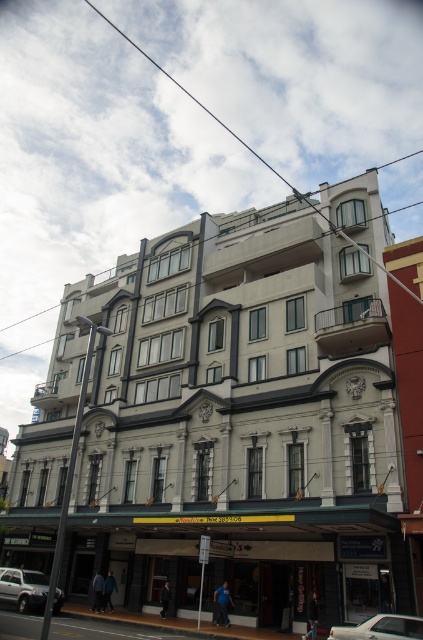
Does point (191, 515) lie behind point (401, 636)?

That is True.

How distant is white smooth building at center from silver metallic sedan at center?

The distance of white smooth building at center from silver metallic sedan at center is 134.25 feet.

Identify the location of white smooth building at center. (227, 419).

Between point (117, 545) and point (43, 582), which one is positioned in front?

Point (43, 582) is in front.

Identify the location of white smooth building at center. The width and height of the screenshot is (423, 640). (227, 419).

The height and width of the screenshot is (640, 423). In order to click on white smooth building at center in this screenshot , I will do `click(227, 419)`.

Who is positioned more to the right, silver metallic car at lower left or silver metallic sedan at center?

silver metallic sedan at center

Can you confirm if silver metallic car at lower left is positioned above silver metallic sedan at center?

No.

You are a GUI agent. You are given a task and a screenshot of the screen. Output one action in this format:
    pyautogui.click(x=<x>, y=<y>)
    Task: Click on the silver metallic car at lower left
    Image resolution: width=423 pixels, height=640 pixels.
    Given the screenshot: What is the action you would take?
    pyautogui.click(x=22, y=588)

Locate an element on the screen. The height and width of the screenshot is (640, 423). silver metallic car at lower left is located at coordinates (22, 588).